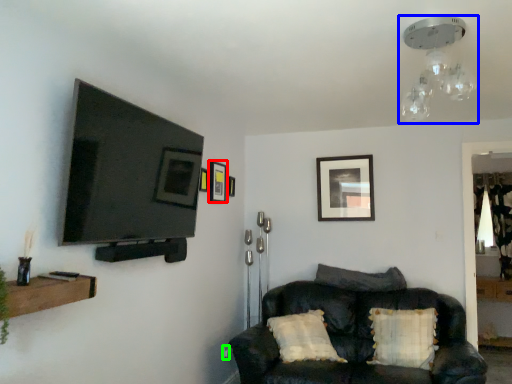
Question: Which object is positioned farthest from picture frame (highlighted by a red box)? Select from light fixture (highlighted by a blue box) and electric outlet (highlighted by a green box).

Choices:
 (A) light fixture
 (B) electric outlet

Answer: (A)